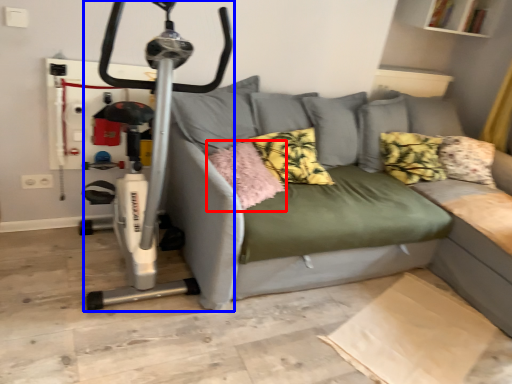
Question: Which object is further to the camera taking this photo, pillow (highlighted by a red box) or sport equipment (highlighted by a blue box)?

Choices:
 (A) pillow
 (B) sport equipment

Answer: (A)